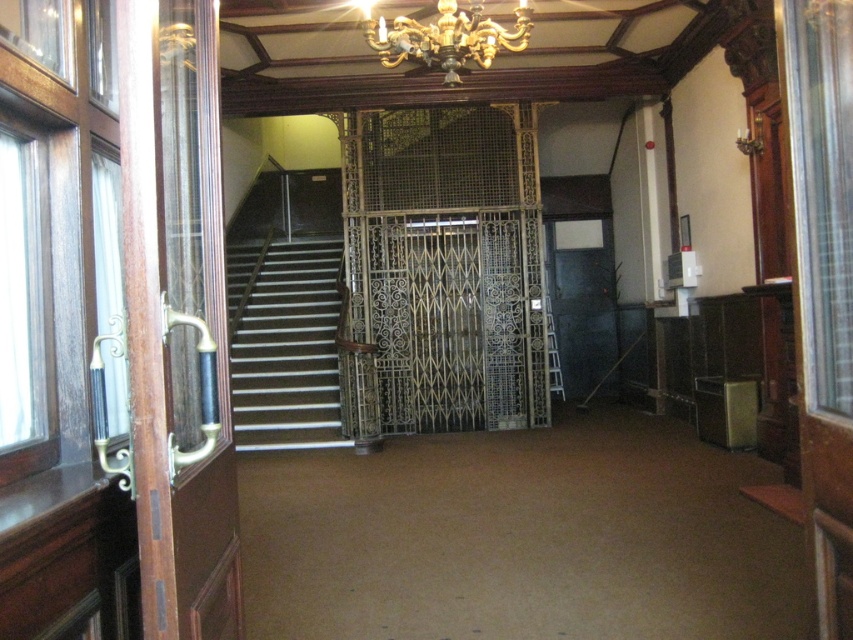
Between wrought iron elevator at center and gold metallic chandelier at upper center, which one is positioned lower?

wrought iron elevator at center is lower down.

Can you confirm if wrought iron elevator at center is wider than gold metallic chandelier at upper center?

Yes, wrought iron elevator at center is wider than gold metallic chandelier at upper center.

Between point (454, 396) and point (462, 52), which one is positioned in front?

Point (462, 52) is in front.

Where is `wrought iron elevator at center`? wrought iron elevator at center is located at coordinates (444, 269).

Is point (375, 115) closer to camera compared to point (264, 324)?

Yes, point (375, 115) is in front of point (264, 324).

Which of these two, wrought iron elevator at center or white glossy stairs at center, stands shorter?

white glossy stairs at center

Locate an element on the screen. The width and height of the screenshot is (853, 640). wrought iron elevator at center is located at coordinates (444, 269).

Does white glossy stairs at center have a lesser width compared to gold metallic chandelier at upper center?

No, white glossy stairs at center is not thinner than gold metallic chandelier at upper center.

Does white glossy stairs at center have a greater height compared to gold metallic chandelier at upper center?

Yes.

You are a GUI agent. You are given a task and a screenshot of the screen. Output one action in this format:
    pyautogui.click(x=<x>, y=<y>)
    Task: Click on the white glossy stairs at center
    The height and width of the screenshot is (640, 853).
    Given the screenshot: What is the action you would take?
    pyautogui.click(x=283, y=342)